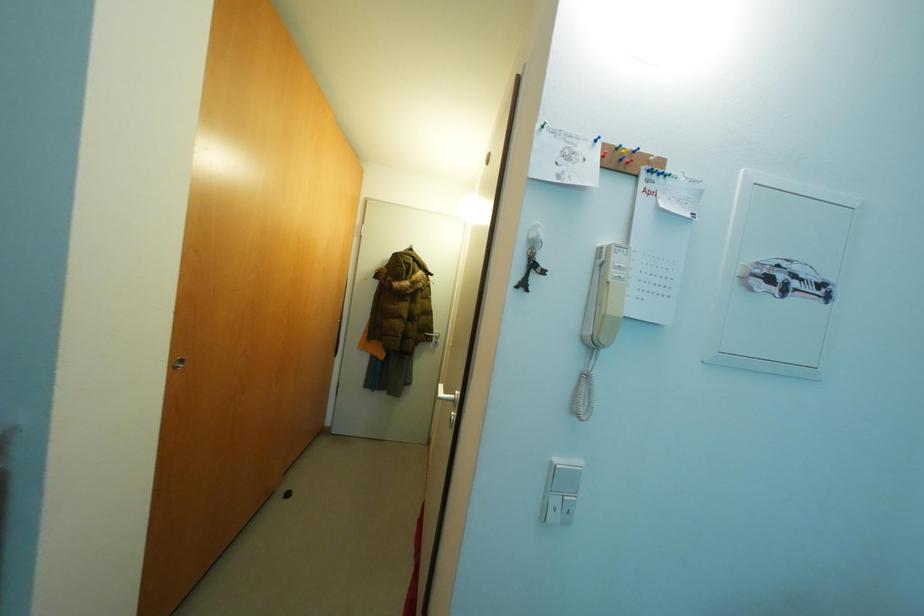
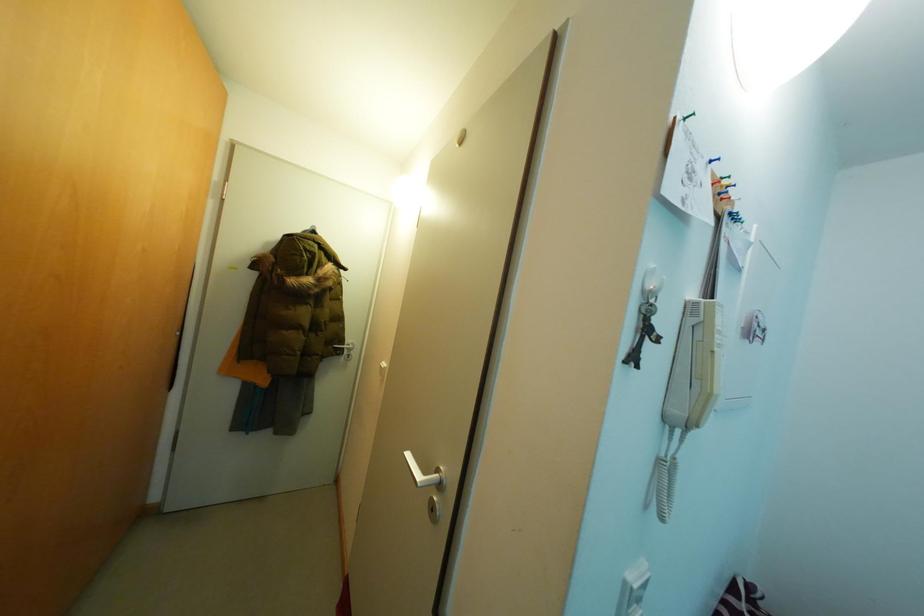
Question: The camera is either moving clockwise (left) or counter-clockwise (right) around the object. The first image is from the beginning of the video and the second image is from the end. Is the camera moving left or right when shooting the video?

Choices:
 (A) Left
 (B) Right

Answer: (A)